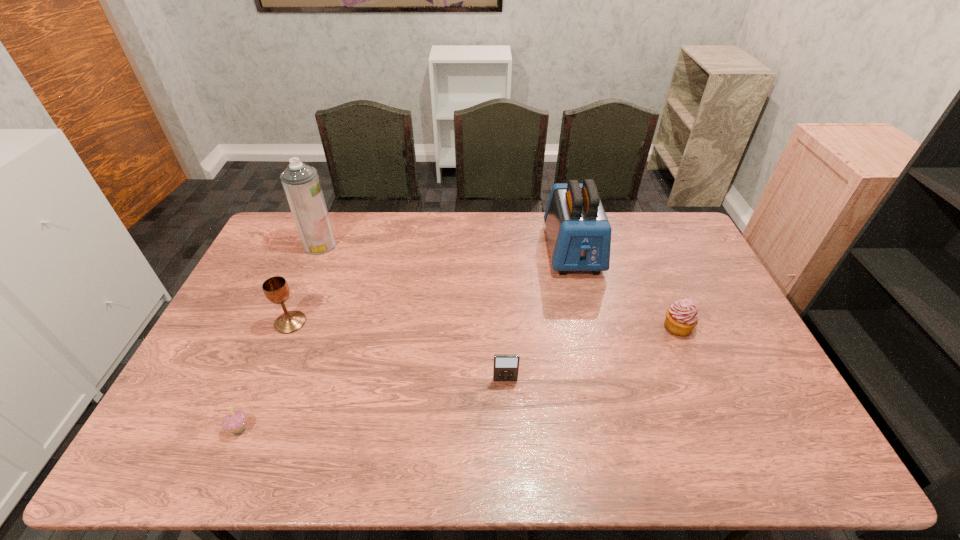
The height and width of the screenshot is (540, 960). I want to click on free space at the far right corner, so click(x=668, y=251).

The width and height of the screenshot is (960, 540). I want to click on free space between the taller cupcake and the fifth shortest object, so coord(625,288).

The width and height of the screenshot is (960, 540). Find the location of `free spot between the third tallest object and the shortest object`. free spot between the third tallest object and the shortest object is located at coordinates (265, 375).

In order to click on vacant space that's between the second object from right to left and the nearest object in this screenshot , I will do `click(406, 339)`.

Locate an element on the screen. vacant space in between the iPod and the taller cupcake is located at coordinates (591, 353).

You are a GUI agent. You are given a task and a screenshot of the screen. Output one action in this format:
    pyautogui.click(x=<x>, y=<y>)
    Task: Click on the vacant area between the tallest object and the iPod
    
    Given the screenshot: What is the action you would take?
    pyautogui.click(x=413, y=313)

Where is `vacant area that lies between the second tallest object and the fifth farthest object`? vacant area that lies between the second tallest object and the fifth farthest object is located at coordinates coord(539,315).

Locate an element on the screen. This screenshot has height=540, width=960. vacant area that lies between the fifth farthest object and the fifth shortest object is located at coordinates (539, 315).

Locate an element on the screen. The height and width of the screenshot is (540, 960). vacant area that lies between the left cupcake and the tallest object is located at coordinates (279, 336).

Locate an element on the screen. This screenshot has width=960, height=540. free space between the rightmost object and the iPod is located at coordinates (591, 353).